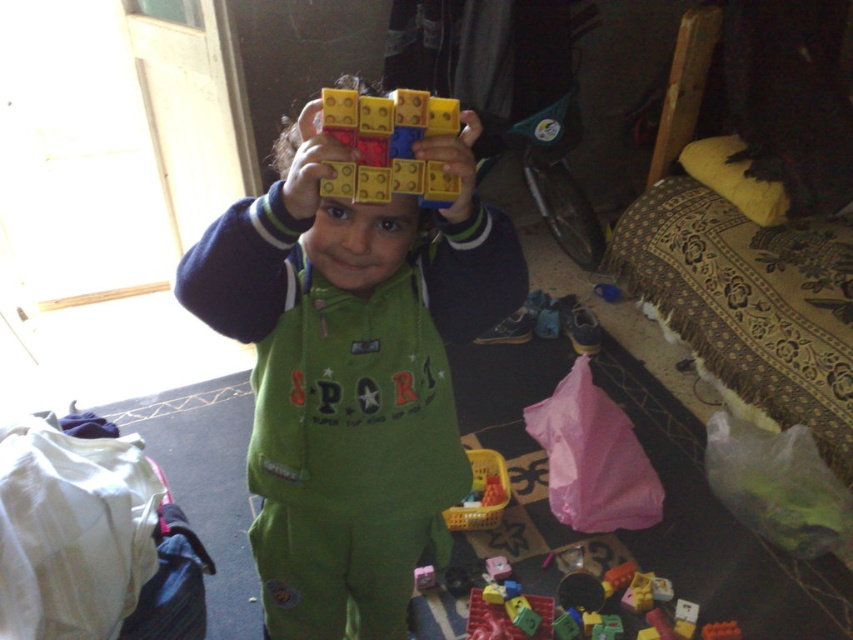
You are trying to decide if the green matte jumpsuit at center can be folded to fit into a storage container designed for items the size of matte plastic blocks at center. Based on their sizes, will it fit?

The green matte jumpsuit at center might be wider than matte plastic blocks at center, so it may not fit into the storage container designed for items the size of matte plastic blocks at center.